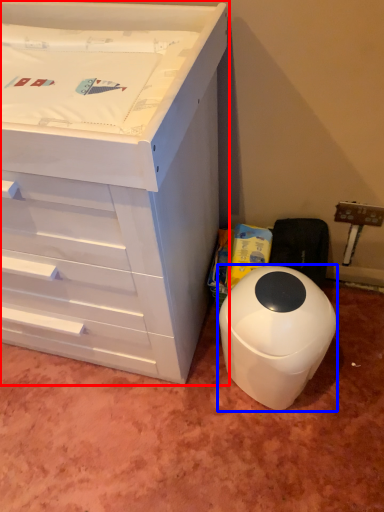
Question: Among these objects, which one is farthest to the camera, chest of drawers (highlighted by a red box) or waste container (highlighted by a blue box)?

Choices:
 (A) chest of drawers
 (B) waste container

Answer: (B)